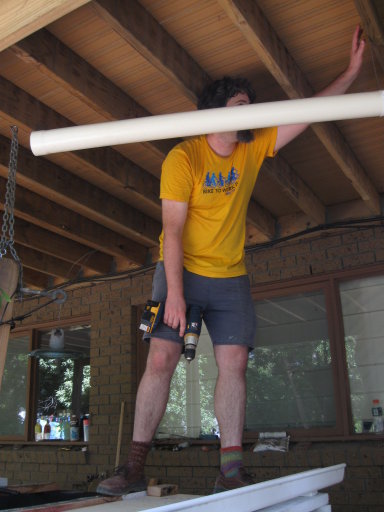
You are a GUI agent. You are given a task and a screenshot of the screen. Output one action in this format:
    pyautogui.click(x=<x>, y=<y>)
    Task: Click on the window
    
    Given the screenshot: What is the action you would take?
    pyautogui.click(x=64, y=368), pyautogui.click(x=10, y=385), pyautogui.click(x=182, y=399), pyautogui.click(x=302, y=346), pyautogui.click(x=366, y=345)